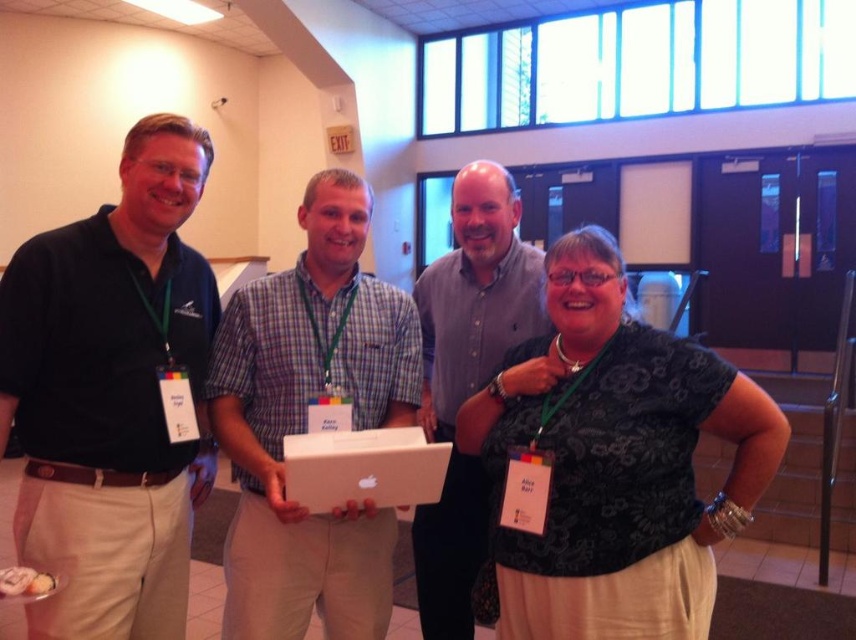
Consider the image. You are a photographer at an event and want to ensure all attendees are visible in the photo. The attendees are the matte black polo shirt at left and the plaid cotton shirt at center. Which attendee is blocking the view of the other?

The matte black polo shirt at left is in front of the plaid cotton shirt at center, so the matte black polo shirt at left is blocking the view of the plaid cotton shirt at center.

You are a photographer standing 2 meters away from the matte black polo shirt at left. You want to take a closeup photo of them without moving closer. Which zoom level should you use if your camera has a standard 50mm lens? Assume the minimum focus distance is 1 meter.

To capture a closeup of the matte black polo shirt at left from 2 meters away with a 50mm lens, you need to ensure the subject fills the frame. Since the minimum focus distance is 1 meter, you can adjust the zoom to approximately 100mm using the camera settings to achieve the desired closeup without moving closer.

You are organizing a small event and need to place the plaid cotton shirt at center and the white cardboard box at center on a table. Which object should you place first if you want to ensure there is enough space for both?

You should place the plaid cotton shirt at center first since it is larger in size than the white cardboard box at center, ensuring there is enough space for both.